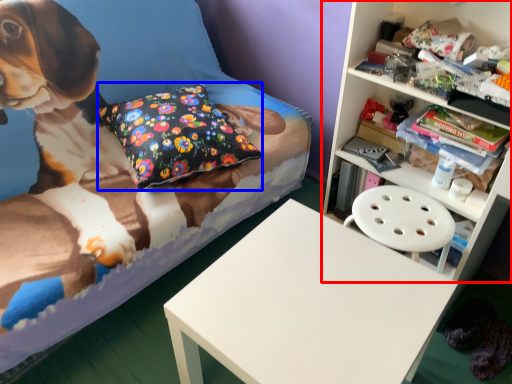
Question: Which object appears closest to the camera in this image, shelf (highlighted by a red box) or pillow (highlighted by a blue box)?

Choices:
 (A) shelf
 (B) pillow

Answer: (A)